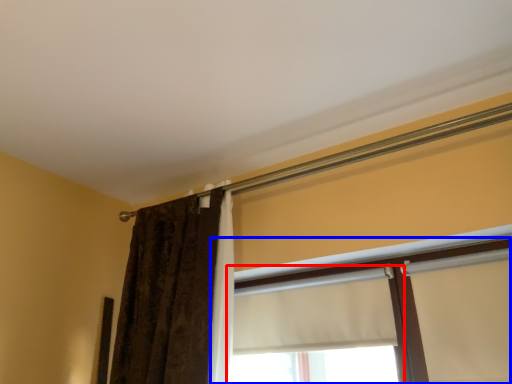
Question: Which of the following is the closest to the observer, window (highlighted by a red box) or window (highlighted by a blue box)?

Choices:
 (A) window
 (B) window

Answer: (B)